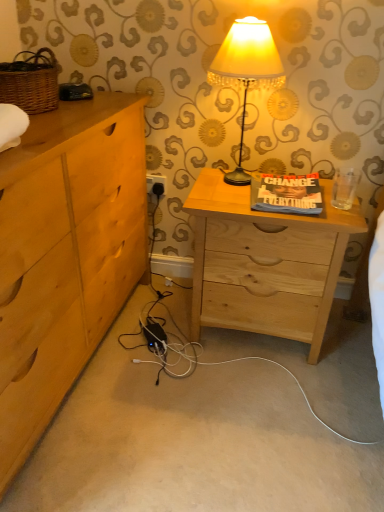
Where is `free region under matte cream lampshade at center (from a real-world perspective)`? free region under matte cream lampshade at center (from a real-world perspective) is located at coordinates (226, 178).